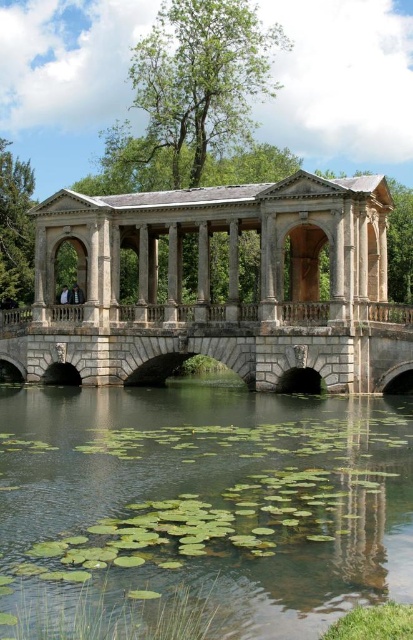
Question: Which object is farther from the camera taking this photo?

Choices:
 (A) stone arch bridge at center
 (B) green leafy water at center

Answer: (A)

Question: Can you confirm if green leafy water at center is positioned above stone arch bridge at center?

Choices:
 (A) yes
 (B) no

Answer: (B)

Question: Which point appears closest to the camera in this image?

Choices:
 (A) (348, 557)
 (B) (140, 292)
 (C) (363, 380)

Answer: (A)

Question: Is the position of green leafy water at center more distant than that of stone arch bridge at center?

Choices:
 (A) yes
 (B) no

Answer: (B)

Question: Considering the relative positions of green leafy water at center and stone arch bridge at center in the image provided, where is green leafy water at center located with respect to stone arch bridge at center?

Choices:
 (A) above
 (B) below

Answer: (B)

Question: Among these points, which one is nearest to the camera?

Choices:
 (A) (242, 564)
 (B) (73, 227)

Answer: (A)